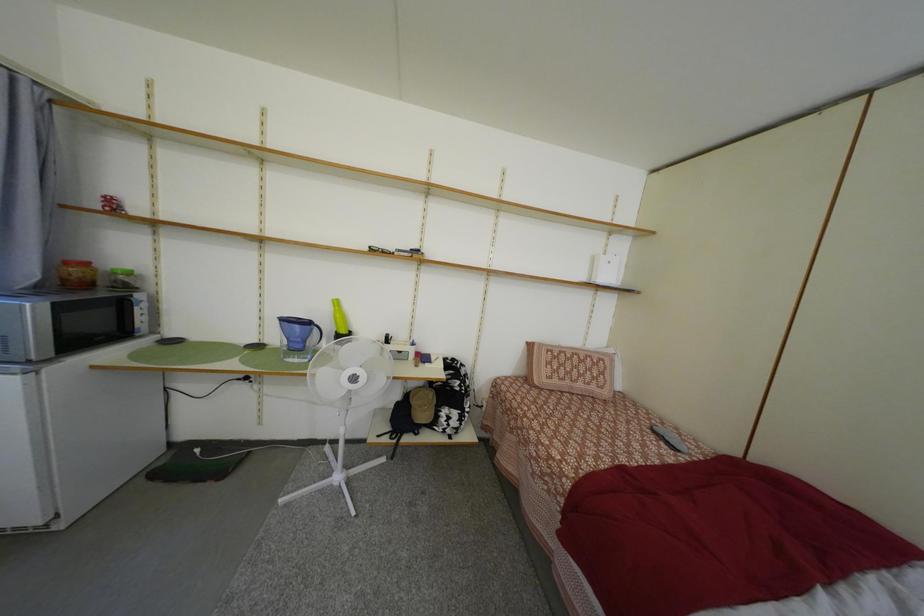
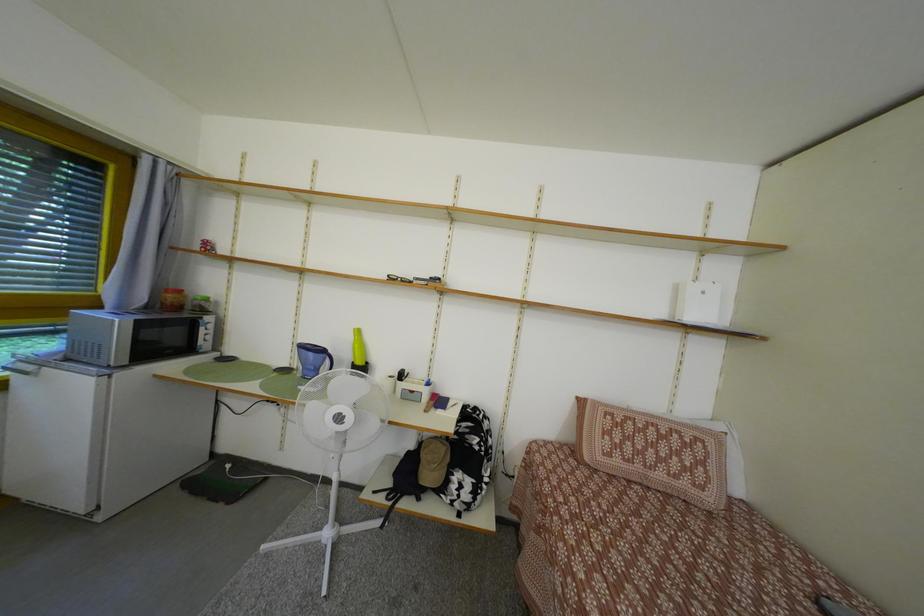
What movement of the cameraman would produce the second image?

The movement direction of the cameraman is right, forward.